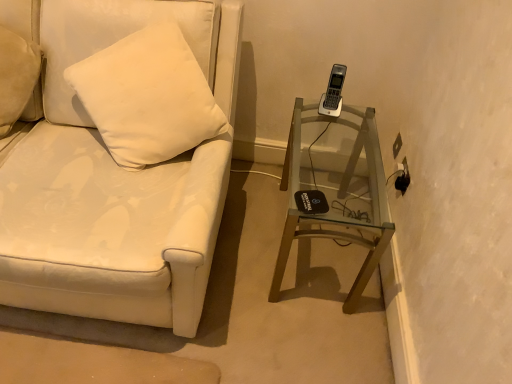
Question: Is white leather couch at left not inside transparent glass table at lower right?

Choices:
 (A) no
 (B) yes

Answer: (B)

Question: Can you confirm if white leather couch at left is thinner than transparent glass table at lower right?

Choices:
 (A) no
 (B) yes

Answer: (A)

Question: From a real-world perspective, does white leather couch at left stand above transparent glass table at lower right?

Choices:
 (A) no
 (B) yes

Answer: (B)

Question: From the image's perspective, is white leather couch at left above transparent glass table at lower right?

Choices:
 (A) no
 (B) yes

Answer: (B)

Question: Does white leather couch at left have a greater height compared to transparent glass table at lower right?

Choices:
 (A) yes
 (B) no

Answer: (A)

Question: Does white leather couch at left have a lesser height compared to transparent glass table at lower right?

Choices:
 (A) yes
 (B) no

Answer: (B)

Question: From a real-world perspective, is transparent glass table at lower right over white leather couch at left?

Choices:
 (A) yes
 (B) no

Answer: (B)

Question: Does transparent glass table at lower right have a smaller size compared to white leather couch at left?

Choices:
 (A) yes
 (B) no

Answer: (A)

Question: Is transparent glass table at lower right thinner than white leather couch at left?

Choices:
 (A) no
 (B) yes

Answer: (B)

Question: Could you tell me if transparent glass table at lower right is turned towards white leather couch at left?

Choices:
 (A) no
 (B) yes

Answer: (A)

Question: Can you confirm if transparent glass table at lower right is positioned to the right of white leather couch at left?

Choices:
 (A) no
 (B) yes

Answer: (B)

Question: Is transparent glass table at lower right taller than white leather couch at left?

Choices:
 (A) yes
 (B) no

Answer: (B)

Question: In the image, is white leather couch at left on the left side or the right side of transparent glass table at lower right?

Choices:
 (A) right
 (B) left

Answer: (B)